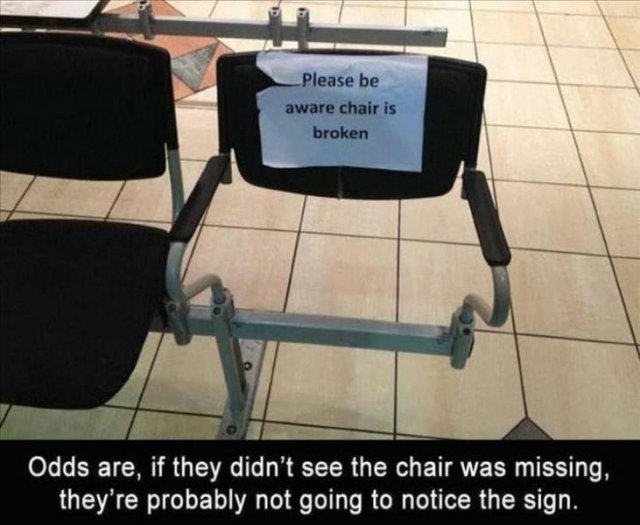
The width and height of the screenshot is (640, 525). I want to click on seat, so click(x=113, y=309).